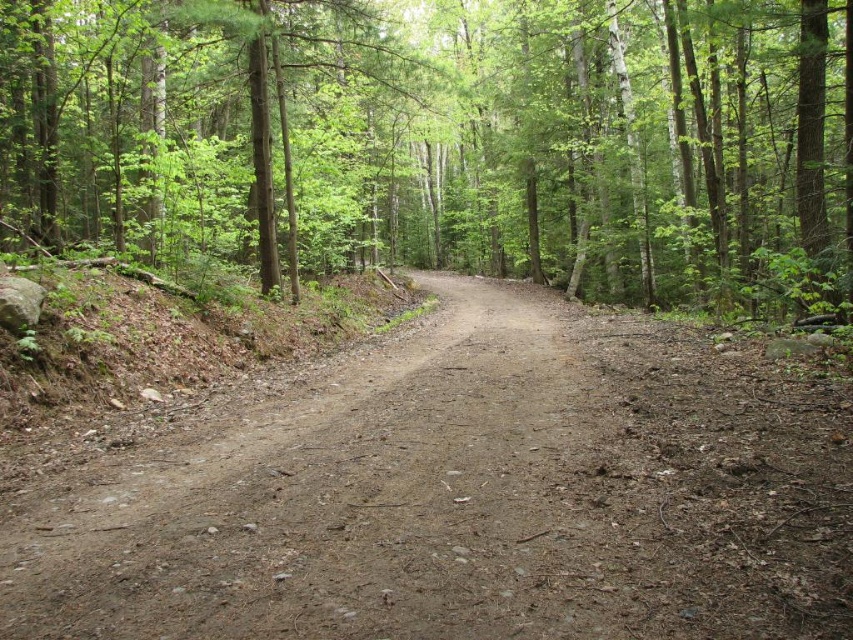
Question: Is brown textured dirt path at center wider than brown gravel path at center?

Choices:
 (A) no
 (B) yes

Answer: (B)

Question: Does brown textured dirt path at center appear under brown gravel path at center?

Choices:
 (A) yes
 (B) no

Answer: (B)

Question: Where is brown textured dirt path at center located in relation to brown gravel path at center in the image?

Choices:
 (A) left
 (B) right

Answer: (A)

Question: Which of the following is the closest to the observer?

Choices:
 (A) brown textured dirt path at center
 (B) brown gravel path at center

Answer: (B)